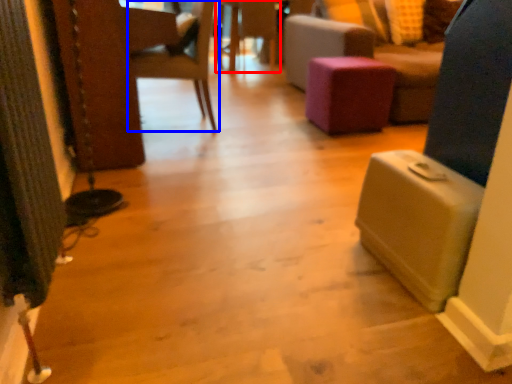
Question: Which object appears farthest to the camera in this image, side table (highlighted by a red box) or chair (highlighted by a blue box)?

Choices:
 (A) side table
 (B) chair

Answer: (A)